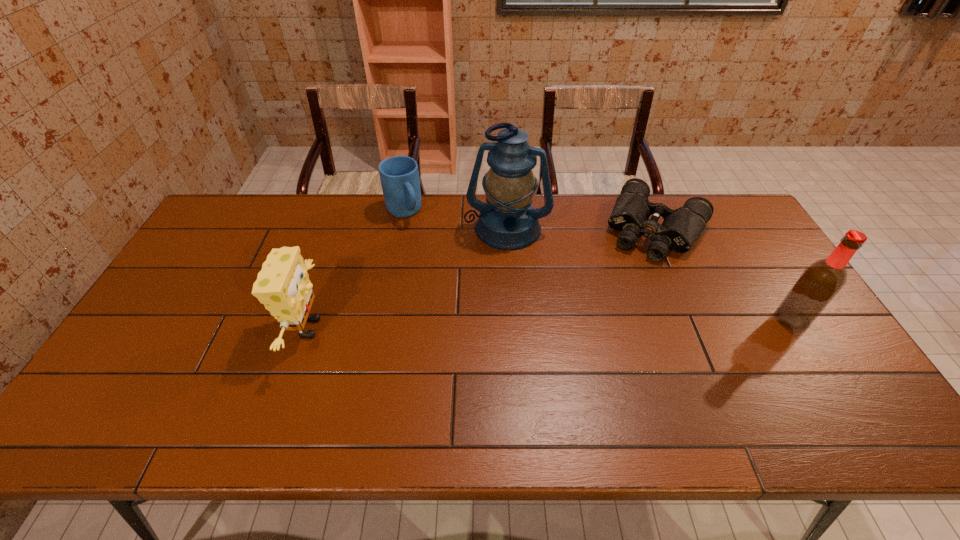
At what (x,y) coordinates should I click in order to perform the action: click on the third shortest object. Please return your answer as a coordinate pair (x, y). Looking at the image, I should click on (283, 286).

The width and height of the screenshot is (960, 540). I want to click on sponge, so click(x=283, y=286).

The height and width of the screenshot is (540, 960). I want to click on the rightmost object, so click(819, 283).

Locate an element on the screen. Image resolution: width=960 pixels, height=540 pixels. the second tallest object is located at coordinates (819, 283).

At what (x,y) coordinates should I click in order to perform the action: click on lantern. Please return your answer as a coordinate pair (x, y). This screenshot has height=540, width=960. Looking at the image, I should click on (507, 221).

The image size is (960, 540). I want to click on the third object from right to left, so click(x=507, y=221).

This screenshot has height=540, width=960. I want to click on the second object from left to right, so click(x=399, y=175).

Identify the location of the fourth tallest object. The height and width of the screenshot is (540, 960). (399, 175).

Where is `the shortest object`? the shortest object is located at coordinates (680, 229).

Identify the location of binoculars. This screenshot has height=540, width=960. (680, 229).